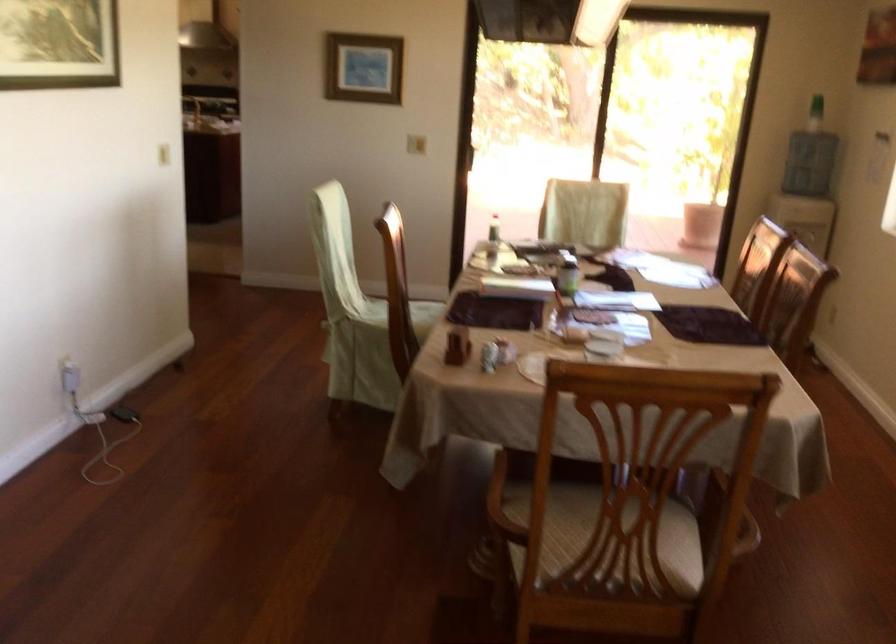
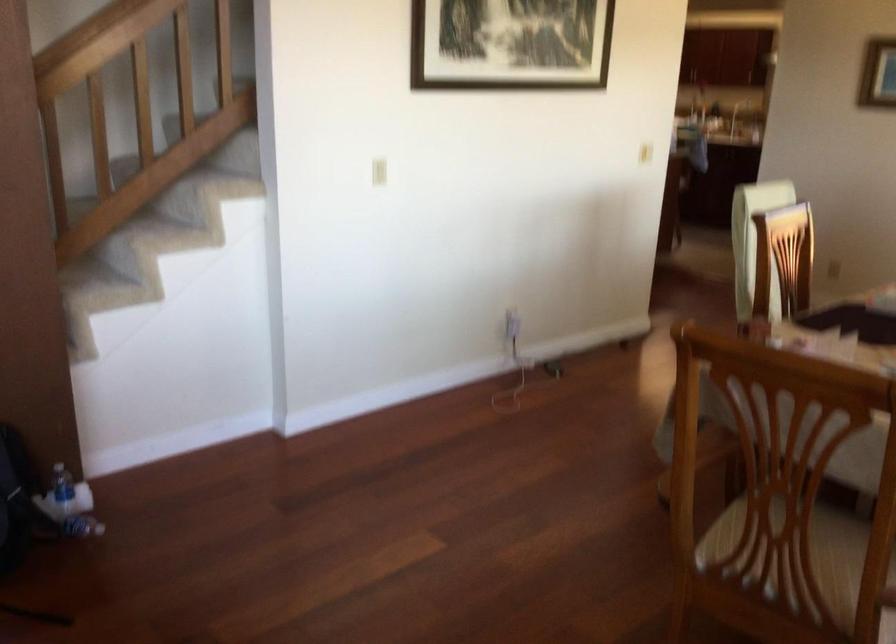
Question: The camera is either moving clockwise (left) or counter-clockwise (right) around the object. The first image is from the beginning of the video and the second image is from the end. Is the camera moving left or right when shooting the video?

Choices:
 (A) Left
 (B) Right

Answer: (B)